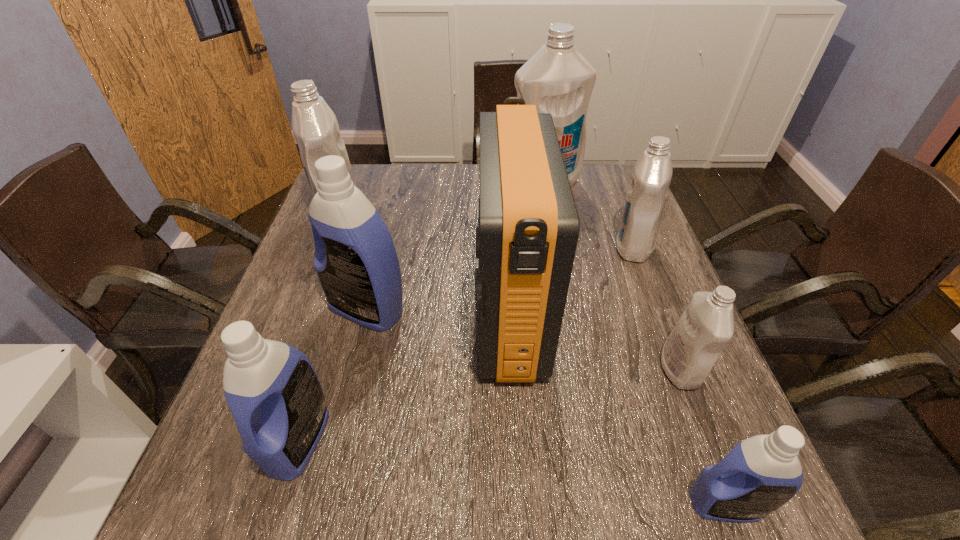
Where is `blank area located on the left of the rightmost blue detergent`? This screenshot has width=960, height=540. blank area located on the left of the rightmost blue detergent is located at coordinates (633, 504).

Find the location of a particular element. Image resolution: width=960 pixels, height=540 pixels. object present at the far left corner is located at coordinates (315, 127).

Find the location of a particular element. This screenshot has height=540, width=960. object present at the near left corner is located at coordinates (274, 394).

The width and height of the screenshot is (960, 540). What are the coordinates of `object at the far right corner` in the screenshot? It's located at (557, 79).

Find the location of `object that is at the near right corner`. object that is at the near right corner is located at coordinates (760, 474).

Locate an element on the screen. Image resolution: width=960 pixels, height=540 pixels. vacant space at the far edge of the desktop is located at coordinates (421, 200).

I want to click on vacant space at the near edge of the desktop, so click(505, 513).

In the image, there is a desktop. Where is `vacant area at the left edge`? vacant area at the left edge is located at coordinates (309, 279).

Locate an element on the screen. free region at the right edge of the desktop is located at coordinates coord(640,372).

This screenshot has height=540, width=960. I want to click on free space at the far right corner of the desktop, so click(593, 166).